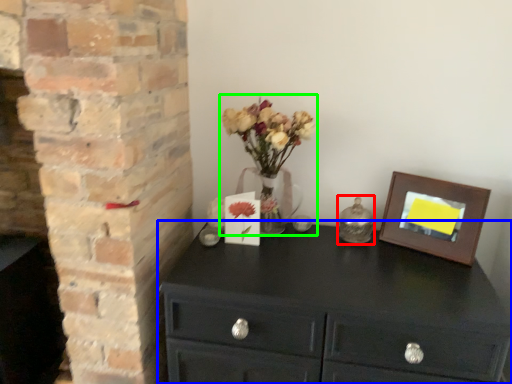
Question: Which object is the farthest from candle holder (highlighted by a red box)? Choose among these: chest of drawers (highlighted by a blue box) or floral arrangement (highlighted by a green box).

Choices:
 (A) chest of drawers
 (B) floral arrangement

Answer: (A)